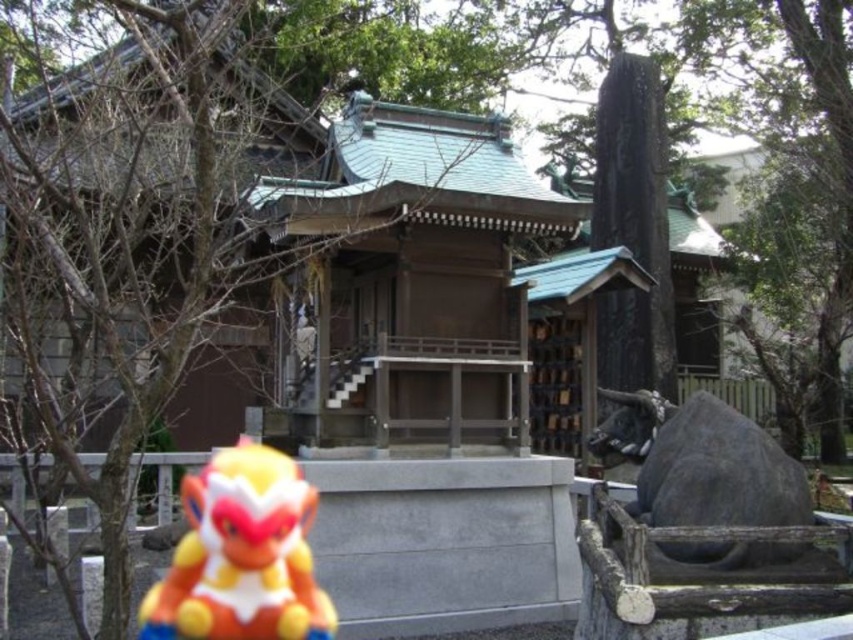
Question: Can you confirm if matte plastic monkey at lower left is bigger than gray stone bull at right?

Choices:
 (A) no
 (B) yes

Answer: (B)

Question: Which point is closer to the camera?

Choices:
 (A) (750, 563)
 (B) (268, 602)

Answer: (A)

Question: Can you confirm if matte plastic monkey at lower left is smaller than gray stone bull at right?

Choices:
 (A) no
 (B) yes

Answer: (A)

Question: Which object is closer to the camera taking this photo?

Choices:
 (A) matte plastic monkey at lower left
 (B) gray stone bull at right

Answer: (B)

Question: From the image, what is the correct spatial relationship of matte plastic monkey at lower left in relation to gray stone bull at right?

Choices:
 (A) right
 (B) left

Answer: (B)